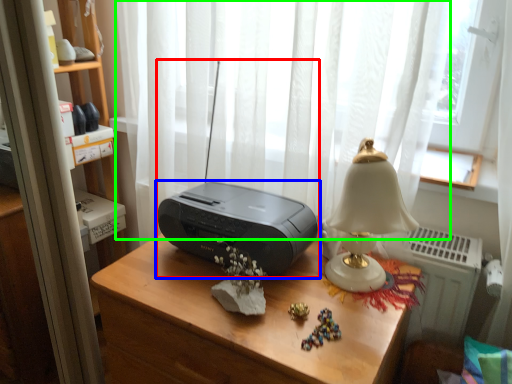
Question: Estimate the real-world distances between objects in this image. Which object is farther from stereo (highlighted by a red box), printer (highlighted by a blue box) or curtain (highlighted by a green box)?

Choices:
 (A) printer
 (B) curtain

Answer: (B)